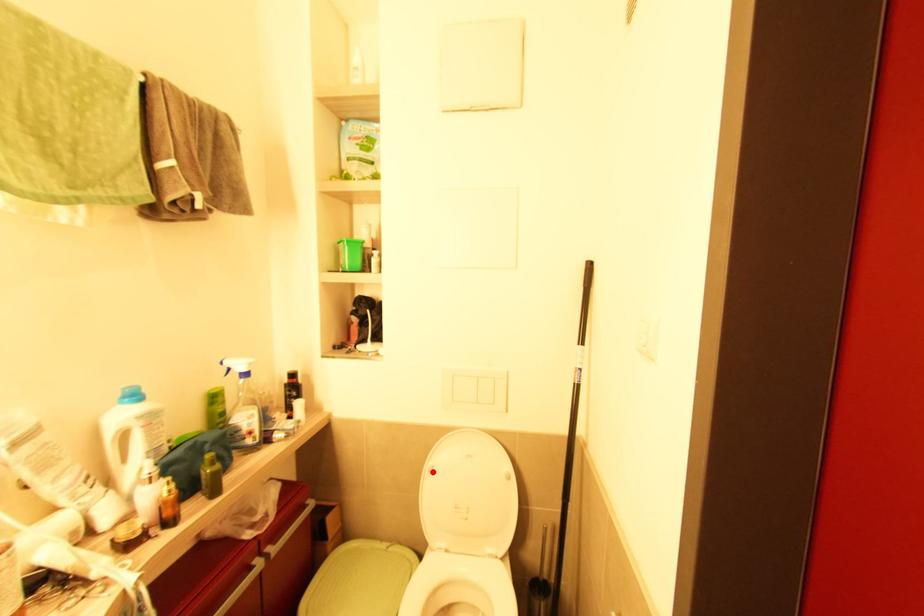
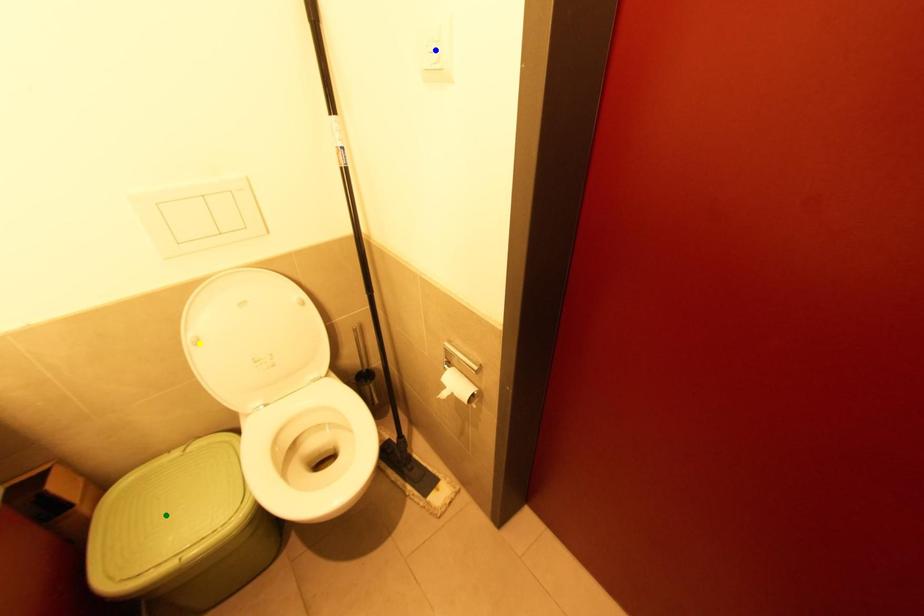
Question: I am providing you with two images of the same scene from different viewpoints. A red point is marked on the first image. You are given multiple points on the second image. Which point in image 2 represents the same 3d spot as the red point in image 1?

Choices:
 (A) green point
 (B) blue point
 (C) yellow point

Answer: (C)